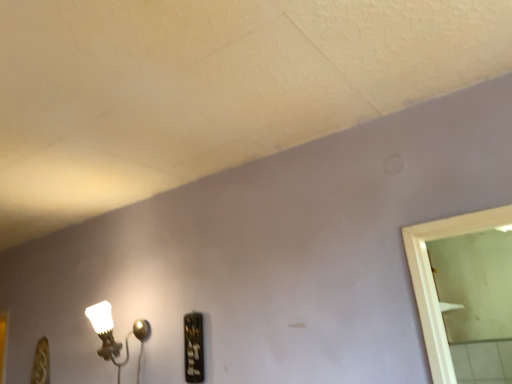
You are a GUI agent. You are given a task and a screenshot of the screen. Output one action in this format:
    pyautogui.click(x=<x>, y=<y>)
    Task: Click on the matte white lamp at lower left
    Image resolution: width=512 pixels, height=384 pixels.
    Given the screenshot: What is the action you would take?
    pyautogui.click(x=113, y=337)

Describe the element at coordinates (113, 337) in the screenshot. This screenshot has width=512, height=384. I see `matte white lamp at lower left` at that location.

Locate an element on the screen. matte white lamp at lower left is located at coordinates 113,337.